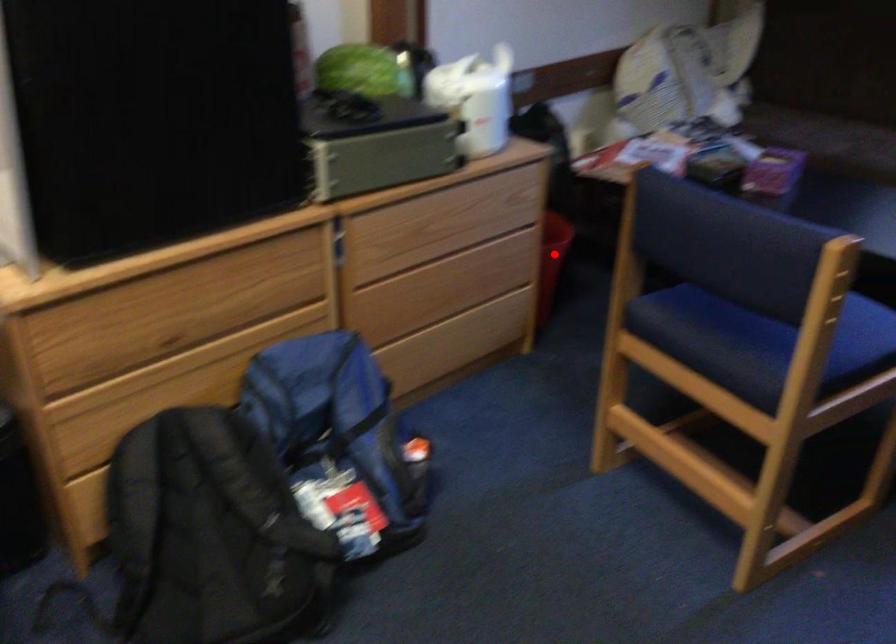
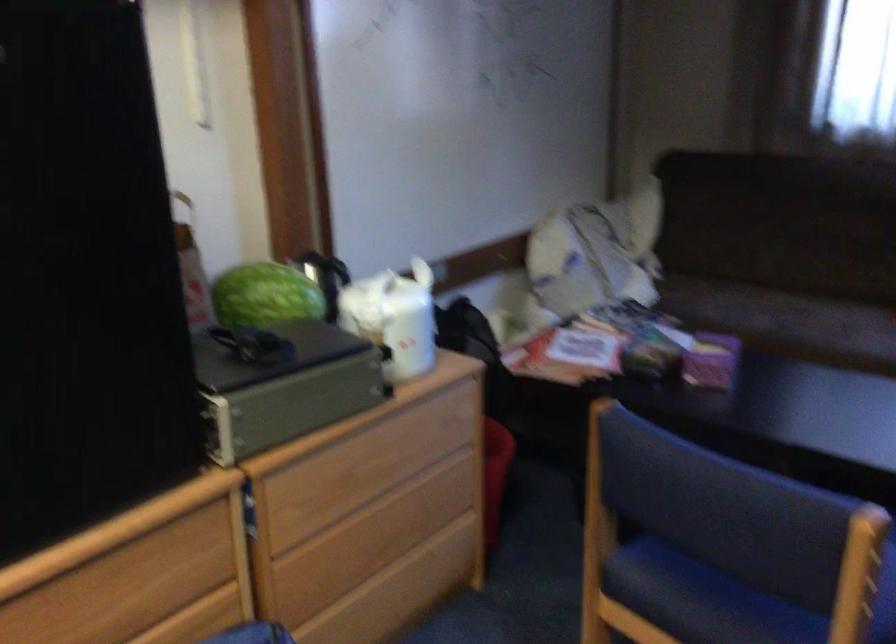
Locate, in the second image, the point that corresponds to the highlighted location in the first image.

(495, 474)